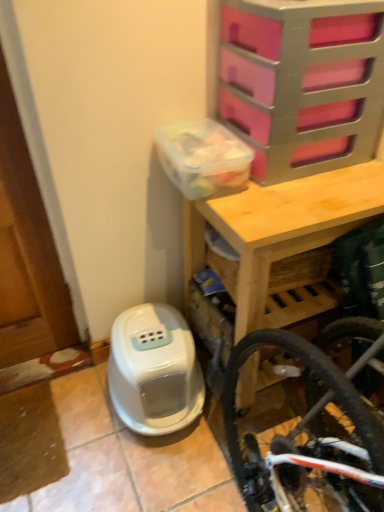
This screenshot has height=512, width=384. What are the coordinates of `unoccupied area in front of pink plastic drawer at upper right` in the screenshot? It's located at (302, 197).